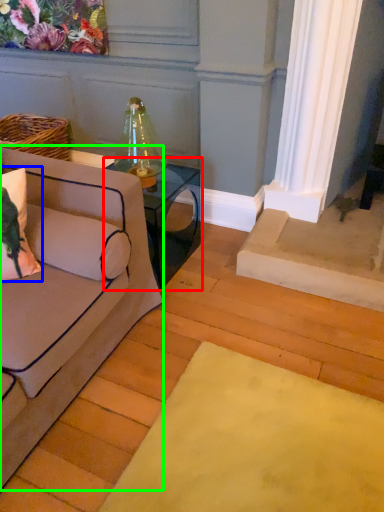
Question: Which object is positioned farthest from table (highlighted by a red box)? Select from pillow (highlighted by a blue box) and studio couch (highlighted by a green box).

Choices:
 (A) pillow
 (B) studio couch

Answer: (A)